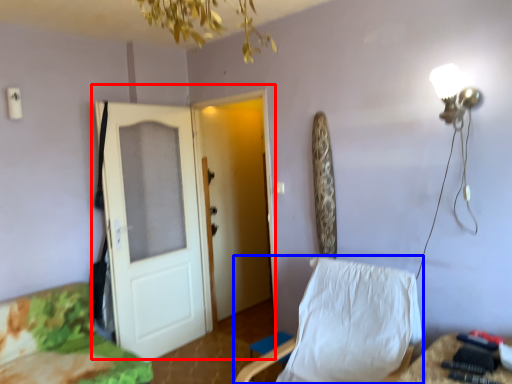
Question: Which object appears closest to the camera in this image, door (highlighted by a red box) or chair (highlighted by a blue box)?

Choices:
 (A) door
 (B) chair

Answer: (B)